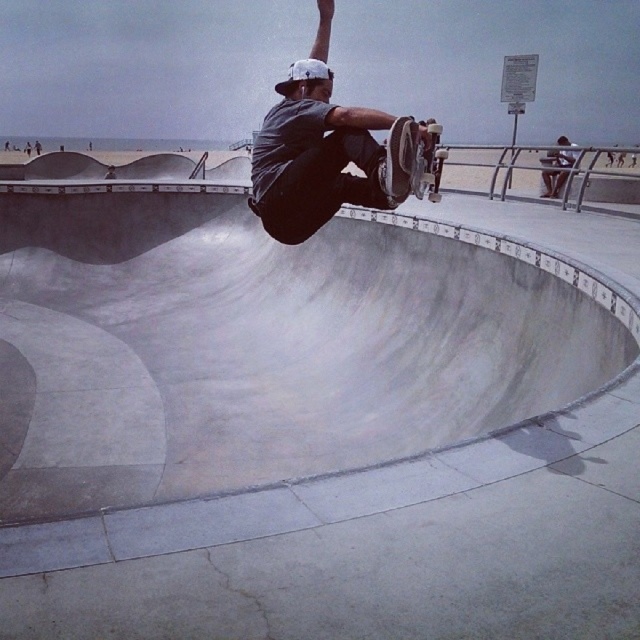
Question: Considering the relative positions of matte gray shirt at center and wooden deck skateboard at center in the image provided, where is matte gray shirt at center located with respect to wooden deck skateboard at center?

Choices:
 (A) above
 (B) below

Answer: (A)

Question: Observing the image, what is the correct spatial positioning of matte gray shirt at center in reference to wooden deck skateboard at center?

Choices:
 (A) below
 (B) above

Answer: (B)

Question: Does matte gray shirt at center appear on the left side of wooden deck skateboard at center?

Choices:
 (A) yes
 (B) no

Answer: (A)

Question: Which of the following is the closest to the observer?

Choices:
 (A) wooden deck skateboard at center
 (B) matte gray shirt at center

Answer: (A)

Question: Which of the following is the closest to the observer?

Choices:
 (A) matte gray shirt at center
 (B) wooden deck skateboard at center

Answer: (B)